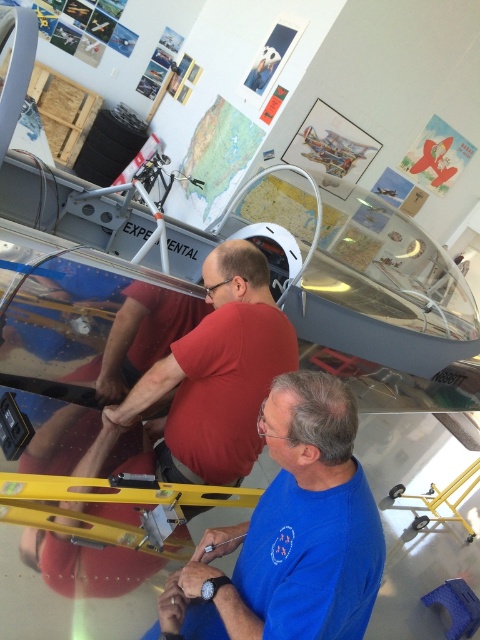
You are an observer standing in front of the hangar. You notice two workers wearing shirts of different colors. Which worker is closer to you, the one wearing the blue fabric shirt at lower center or the one in the matte red shirt at center?

The blue fabric shirt at lower center is shorter than the matte red shirt at center, so the worker in the blue fabric shirt at lower center is closer to you.

You are a visitor in the hangar and want to take a photo of both the blue fabric shirt at lower center and the matte red shirt at center. Which shirt should you focus on first to ensure both are in clear view?

The blue fabric shirt at lower center is closer to the viewer than the matte red shirt at center, so focus on the blue fabric shirt at lower center first to ensure both are in clear focus.

You are a visitor in the hangar and need to locate the person wearing the blue fabric shirt at lower center. Which direction should you look relative to the person in the matte red shirt at center?

The blue fabric shirt at lower center is to the right of the matte red shirt at center, so you should look to the right of the matte red shirt at center to find the person in the blue fabric shirt at lower center.